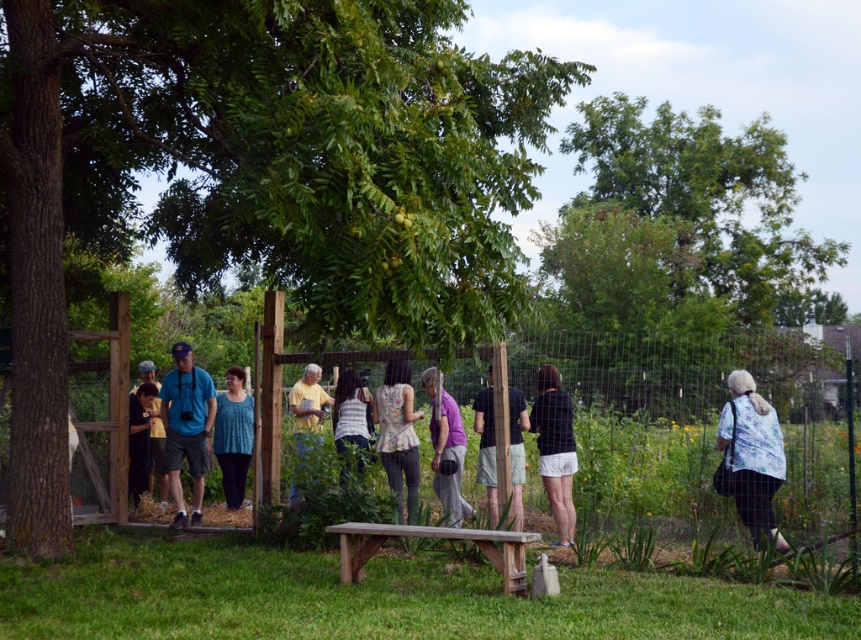
Question: Where is white floral shirt at lower right located in relation to teal knitted top at center in the image?

Choices:
 (A) left
 (B) right

Answer: (B)

Question: Is green leafy tree at center bigger than white floral shirt at lower right?

Choices:
 (A) no
 (B) yes

Answer: (A)

Question: Can you confirm if matte blue shirt at center is thinner than teal knitted top at center?

Choices:
 (A) no
 (B) yes

Answer: (A)

Question: Which point is closer to the camera taking this photo?

Choices:
 (A) (426, 378)
 (B) (191, 433)
 (C) (23, 164)
 (D) (539, 438)

Answer: (C)

Question: Which object is the closest to the teal knitted top at center?

Choices:
 (A) dark green fabric shirt at center
 (B) white floral shirt at lower right
 (C) rustic wood bench at center
 (D) white fabric dress at center

Answer: (D)

Question: Which is farther from the matte blue shirt at center?

Choices:
 (A) teal knitted top at center
 (B) dark green fabric shirt at center

Answer: (B)